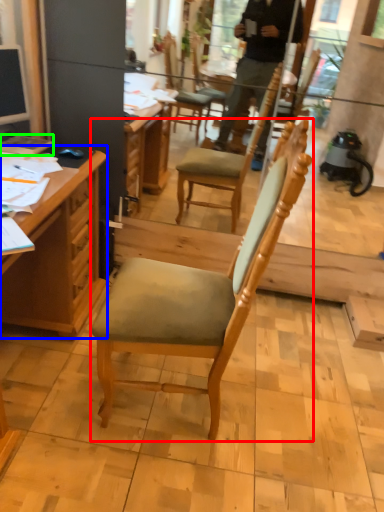
Question: Estimate the real-world distances between objects in this image. Which object is closer to chair (highlighted by a red box), desk (highlighted by a blue box) or book (highlighted by a green box)?

Choices:
 (A) desk
 (B) book

Answer: (A)